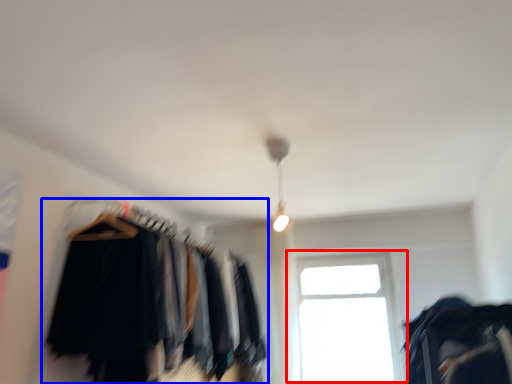
Question: Which object appears closest to the camera in this image, window (highlighted by a red box) or closet (highlighted by a blue box)?

Choices:
 (A) window
 (B) closet

Answer: (B)